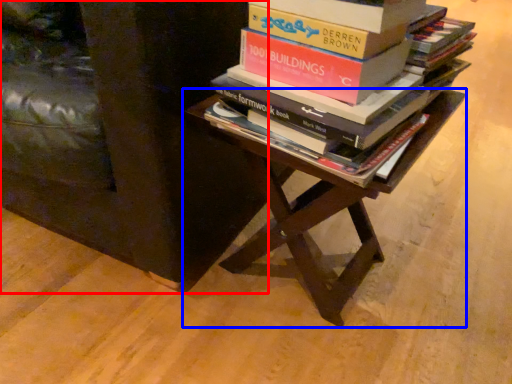
Question: Which point is closer to the camera, furniture (highlighted by a red box) or table (highlighted by a blue box)?

Choices:
 (A) furniture
 (B) table

Answer: (A)